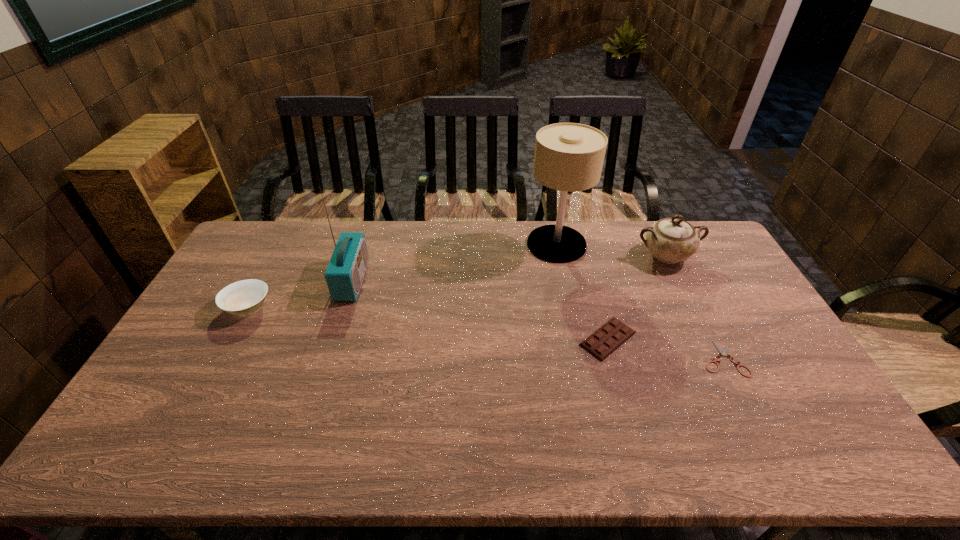
I want to click on table lamp, so (x=569, y=157).

Where is `radio receiver`? radio receiver is located at coordinates (345, 272).

In order to click on the second tallest object in this screenshot , I will do pyautogui.click(x=345, y=272).

The height and width of the screenshot is (540, 960). Find the location of `the third tallest object`. the third tallest object is located at coordinates (671, 240).

You are a GUI agent. You are given a task and a screenshot of the screen. Output one action in this format:
    pyautogui.click(x=<x>, y=<y>)
    Task: Click on the bowl
    This screenshot has width=960, height=540.
    Given the screenshot: What is the action you would take?
    pyautogui.click(x=245, y=297)

This screenshot has height=540, width=960. What are the coordinates of `the fourth tallest object` in the screenshot? It's located at (245, 297).

Find the location of a particular element. chocolate bar is located at coordinates (603, 342).

Find the location of a particular element. The image size is (960, 540). shears is located at coordinates (724, 352).

Locate an element on the screen. This screenshot has width=960, height=540. vacant area situated on the front of the table lamp is located at coordinates [564, 281].

You are a GUI agent. You are given a task and a screenshot of the screen. Output one action in this format:
    pyautogui.click(x=<x>, y=<y>)
    Task: Click on the free space located on the front panel of the radio receiver
    Image resolution: width=960 pixels, height=540 pixels.
    Given the screenshot: What is the action you would take?
    pyautogui.click(x=467, y=280)